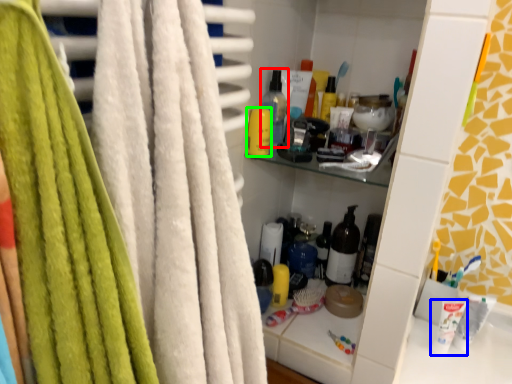
Question: Estimate the real-world distances between objects in this image. Which object is closer to bottle (highlighted by a red box), toothpaste (highlighted by a blue box) or toiletry (highlighted by a green box)?

Choices:
 (A) toothpaste
 (B) toiletry

Answer: (B)